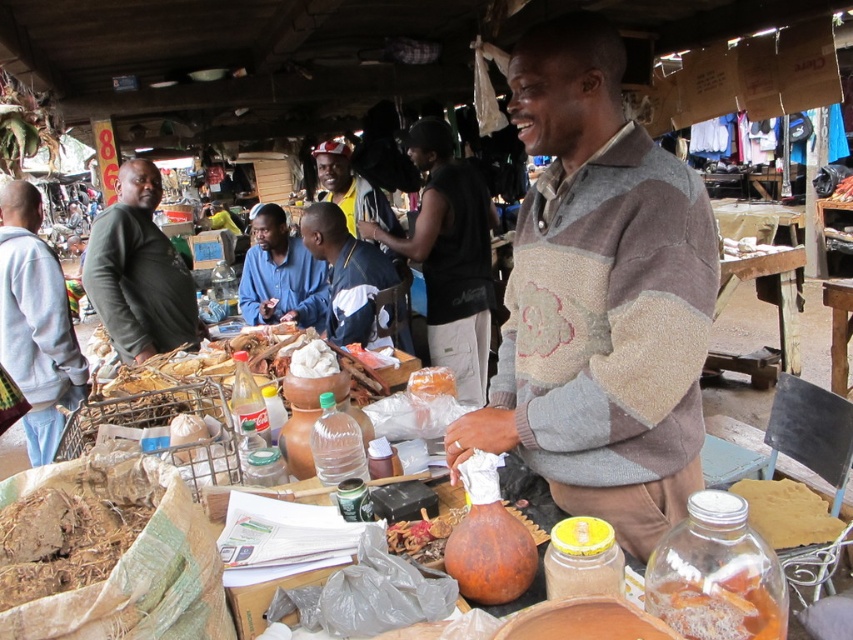
Question: Is blue cotton shirt at center to the left of shiny metallic skewers at center from the viewer's perspective?

Choices:
 (A) yes
 (B) no

Answer: (A)

Question: Which of the following is the farthest from the observer?

Choices:
 (A) matte plastic cap at center
 (B) brown dried leaves at center
 (C) gray sweatshirt at left

Answer: (A)

Question: Is patchwork sweater at center to the left of blue fabric shirt at center from the viewer's perspective?

Choices:
 (A) yes
 (B) no

Answer: (B)

Question: Based on their relative distances, which object is nearer to the wooden table at center?

Choices:
 (A) blue cotton shirt at center
 (B) dark green sweater at left

Answer: (A)

Question: Which object is farther from the camera taking this photo?

Choices:
 (A) gray sweatshirt at left
 (B) shiny metallic skewers at center

Answer: (B)

Question: Is gray sweatshirt at left behind blue fabric shirt at center?

Choices:
 (A) yes
 (B) no

Answer: (B)